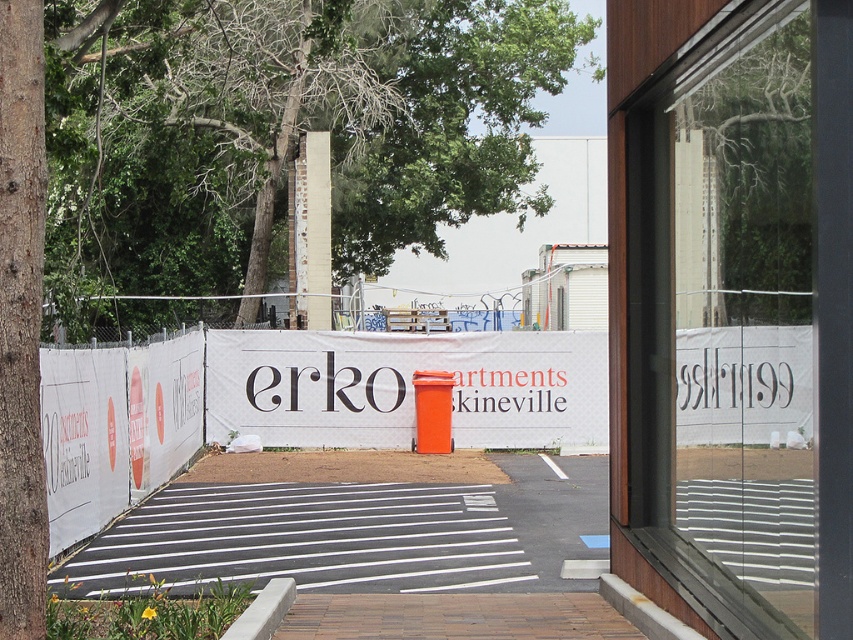
You are a delivery person approaching the construction site and need to hand over a package to the office inside. The office has a transparent glass window at center and a white fabric banner at center. Which object should you approach first to reach the office?

The transparent glass window at center is closer to the viewer than the white fabric banner at center, so you should approach the transparent glass window at center first to reach the office.

You are a delivery person trying to see through the transparent glass window at center to check if the package is inside the construction site. However, there is a green leafy tree at upper left blocking your view. Can you see through the window clearly?

The transparent glass window at center is narrower than the green leafy tree at upper left, so the tree might be blocking your view through the window.